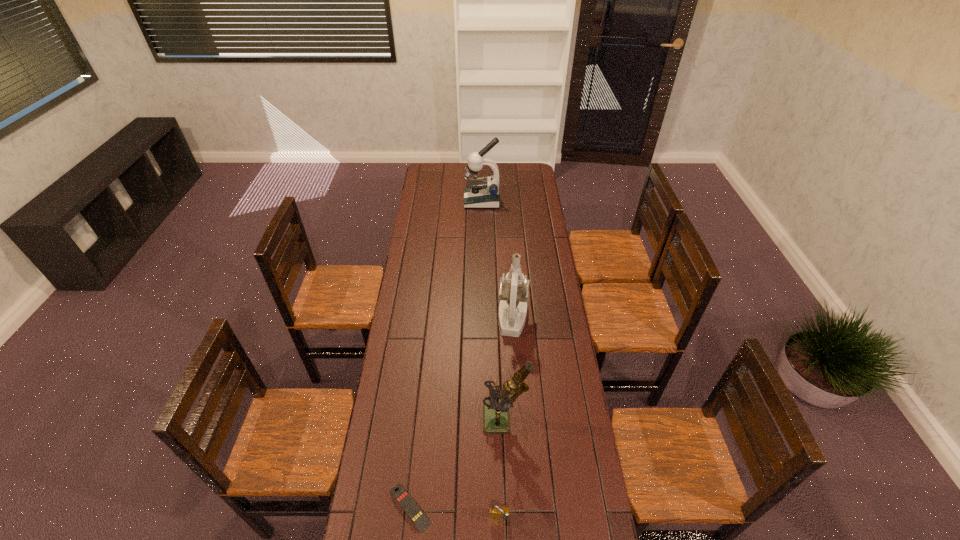
Where is `vacant space at the far right corner`? This screenshot has height=540, width=960. vacant space at the far right corner is located at coordinates (533, 179).

Locate an element on the screen. The width and height of the screenshot is (960, 540). empty space between the farthest microscope and the third nearest object is located at coordinates (493, 310).

You are a GUI agent. You are given a task and a screenshot of the screen. Output one action in this format:
    pyautogui.click(x=<x>, y=<y>)
    Task: Click on the free area in between the farthest object and the nearest microscope
    The height and width of the screenshot is (540, 960).
    Given the screenshot: What is the action you would take?
    pyautogui.click(x=493, y=310)

The image size is (960, 540). What are the coordinates of `vacant area that lies between the padlock and the leftmost object` in the screenshot? It's located at (455, 513).

The height and width of the screenshot is (540, 960). Identify the location of free space between the second farthest object and the leftmost object. (461, 413).

At what (x,y) coordinates should I click in order to perform the action: click on vacant area that lies between the farthest object and the padlock. Please return your answer as a coordinate pair (x, y). The width and height of the screenshot is (960, 540). Looking at the image, I should click on (491, 360).

The image size is (960, 540). Find the location of `free space between the second nearest microscope and the farthest microscope`. free space between the second nearest microscope and the farthest microscope is located at coordinates (497, 259).

You are a GUI agent. You are given a task and a screenshot of the screen. Output one action in this format:
    pyautogui.click(x=<x>, y=<y>)
    Task: Click on the vacant point located between the padlock and the farthest microscope
    
    Given the screenshot: What is the action you would take?
    pyautogui.click(x=491, y=360)

Locate an element on the screen. Image resolution: width=960 pixels, height=540 pixels. vacant region between the leftmost object and the second farthest microscope is located at coordinates (461, 413).

In order to click on empty space between the fourth nearest object and the farthest object in this screenshot , I will do `click(497, 259)`.